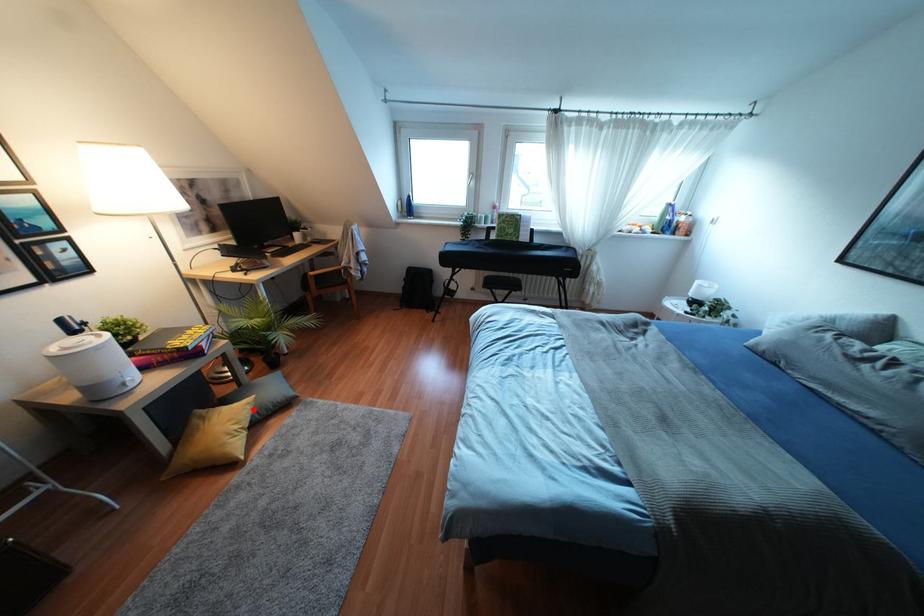
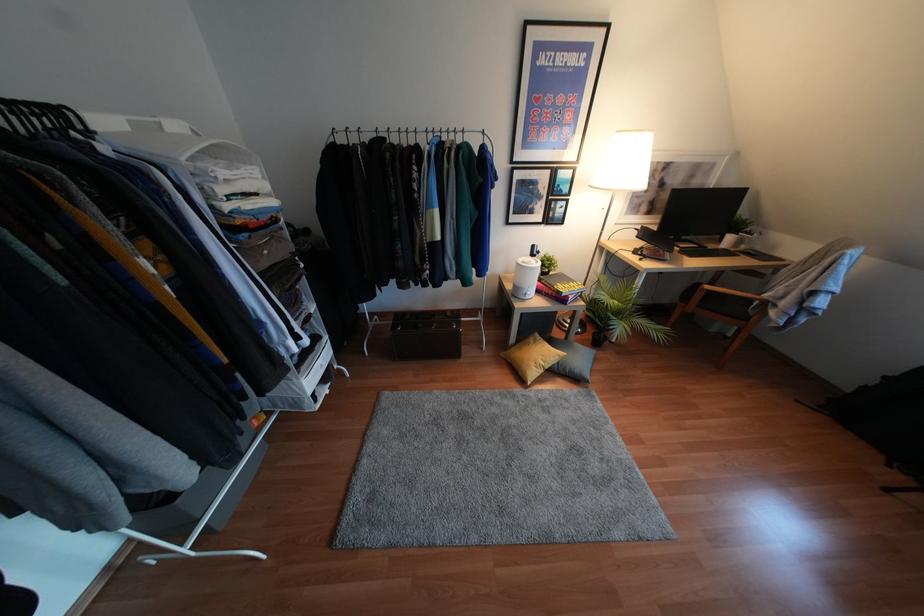
Question: I am providing you with two images of the same scene from different viewpoints. Image1 has a red point marked. In image2, the corresponding 3D location appears at what relative position? Reply with the corresponding letter.

Choices:
 (A) Closer
 (B) Farther

Answer: (B)